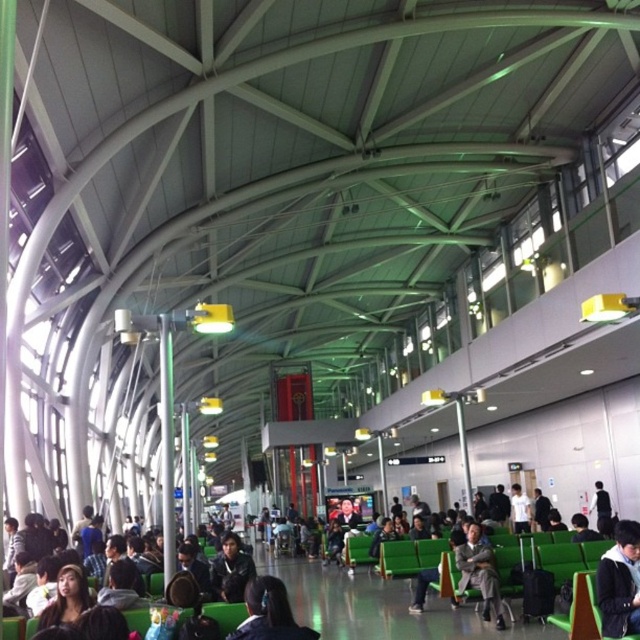
You are standing in the waiting area and notice a person with dark hair at center. Based on the coordinates provided, can you determine if this person is closer to the front or the back of the waiting area?

The dark hair at center is located at point 0.958 on the x or y axis, which indicates it is closer to the back of the waiting area since higher values typically represent rear positions in such coordinate systems.

You are a maintenance worker in the waiting area and need to reach the dark hair at center and the white matte shirt at center. Which object is farther away from you?

The dark hair at center is 44.99 feet away from the white matte shirt at center, so the dark hair at center is farther away from you.

Looking at this image, you are a customer service representative in the waiting area. You see two jackets at the center of the scene. Which jacket is closer to you, the black leather jacket at center or the black fabric jacket at center?

The black leather jacket at center is closer to you because it is in front of the black fabric jacket at center.